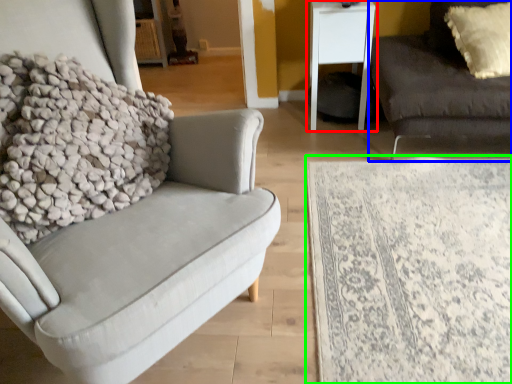
Question: Which object is the farthest from table (highlighted by a red box)? Choose among these: studio couch (highlighted by a blue box) or plain (highlighted by a green box).

Choices:
 (A) studio couch
 (B) plain

Answer: (B)